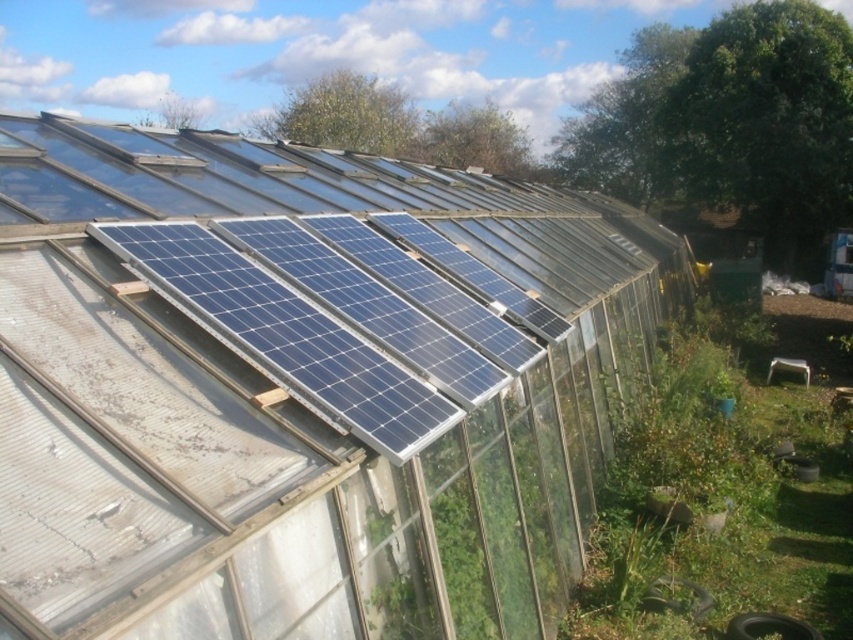
Who is positioned more to the right, blue solar panels at upper center or blue glossy solar panels at upper center?

From the viewer's perspective, blue solar panels at upper center appears more on the right side.

Measure the distance between point (415,604) and camera.

A distance of 3.18 meters exists between point (415,604) and camera.

This screenshot has width=853, height=640. Identify the location of blue solar panels at upper center. (303, 388).